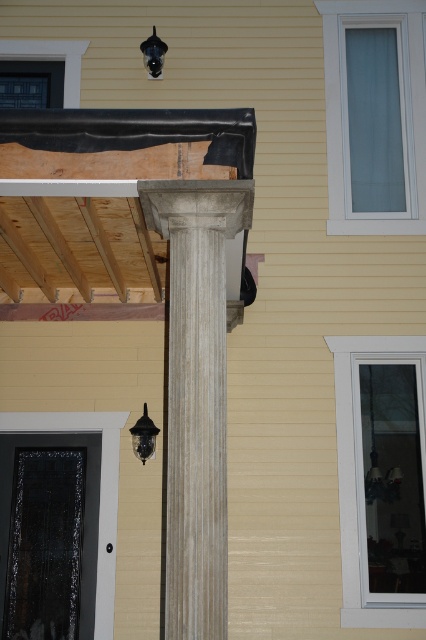
Which is below, matte black lamp at lower left or metallic black lamp at upper center?

matte black lamp at lower left

Can you confirm if matte black lamp at lower left is positioned to the left of metallic black lamp at upper center?

No, matte black lamp at lower left is not to the left of metallic black lamp at upper center.

The image size is (426, 640). What do you see at coordinates (143, 436) in the screenshot?
I see `matte black lamp at lower left` at bounding box center [143, 436].

This screenshot has height=640, width=426. Identify the location of matte black lamp at lower left. (143, 436).

Measure the distance from gray stone column at center to metallic black lamp at upper center.

gray stone column at center and metallic black lamp at upper center are 10.92 feet apart from each other.

Is gray stone column at center to the right of metallic black lamp at upper center from the viewer's perspective?

Yes, gray stone column at center is to the right of metallic black lamp at upper center.

Is point (199, 499) more distant than point (146, 64)?

No, (199, 499) is in front of (146, 64).

The width and height of the screenshot is (426, 640). In order to click on gray stone column at center in this screenshot , I will do `click(196, 394)`.

Is gray stone column at center taller than matte black lamp at lower left?

Correct, gray stone column at center is much taller as matte black lamp at lower left.

Who is taller, gray stone column at center or matte black lamp at lower left?

With more height is gray stone column at center.

Between point (181, 602) and point (135, 444), which one is positioned in front?

Point (181, 602) is more forward.

You are a GUI agent. You are given a task and a screenshot of the screen. Output one action in this format:
    pyautogui.click(x=<x>, y=<y>)
    Task: Click on the gray stone column at center
    The width and height of the screenshot is (426, 640).
    Given the screenshot: What is the action you would take?
    pyautogui.click(x=196, y=394)